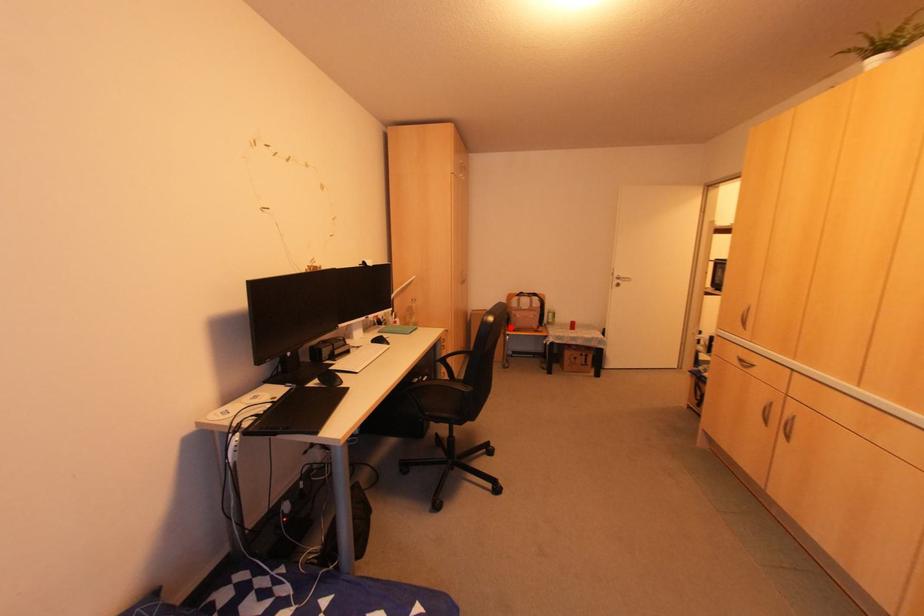
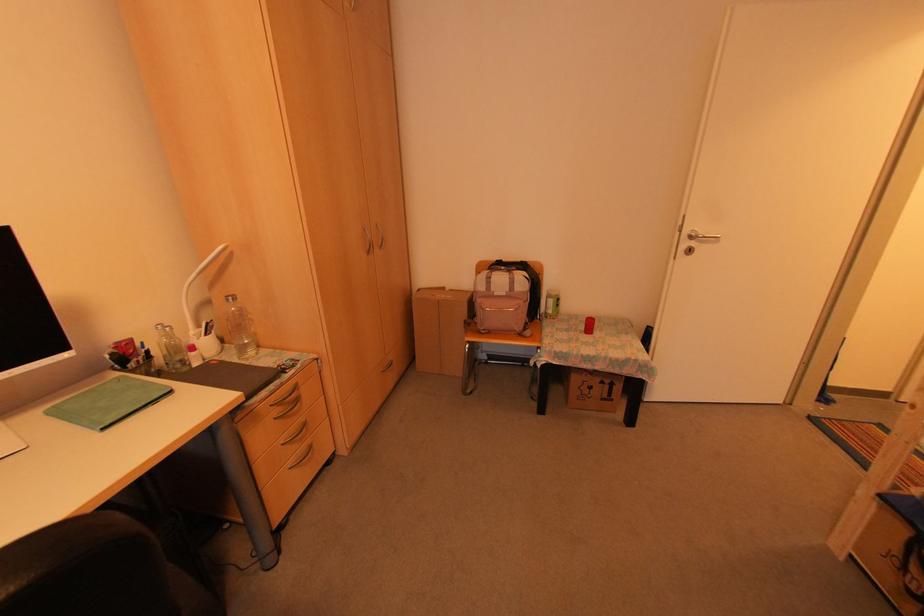
Find the pixel in the second image that matches the highlighted location in the first image.

(477, 326)